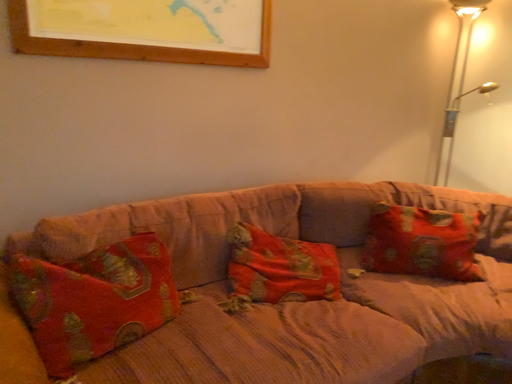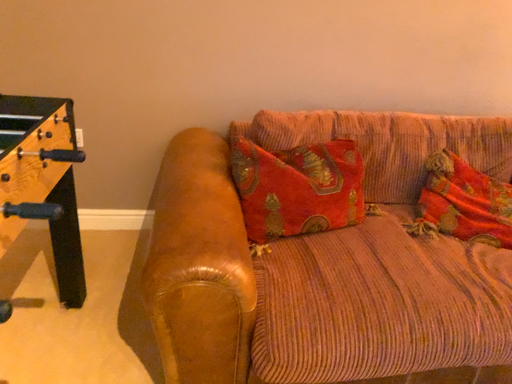
Question: Which way did the camera rotate in the video?

Choices:
 (A) rotated upward
 (B) rotated downward

Answer: (B)